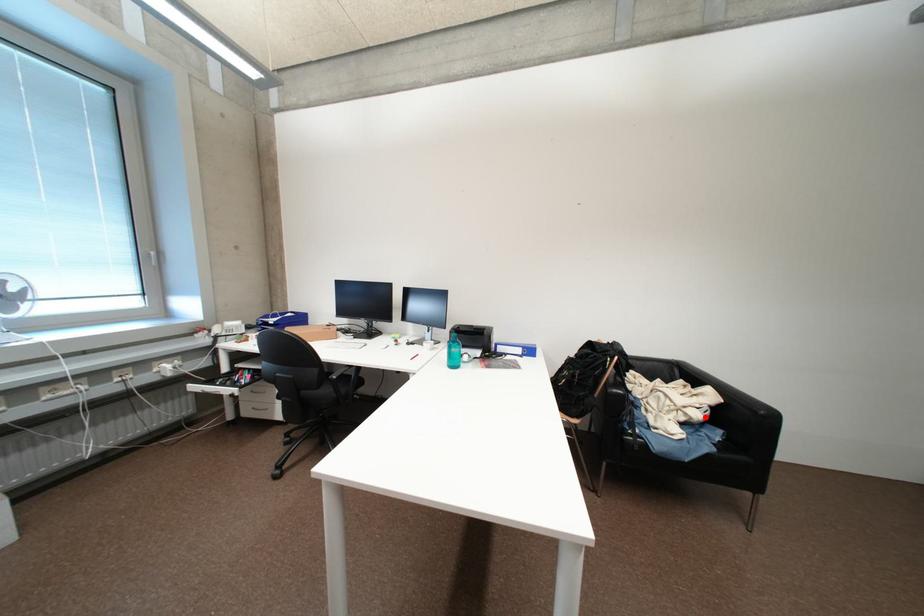
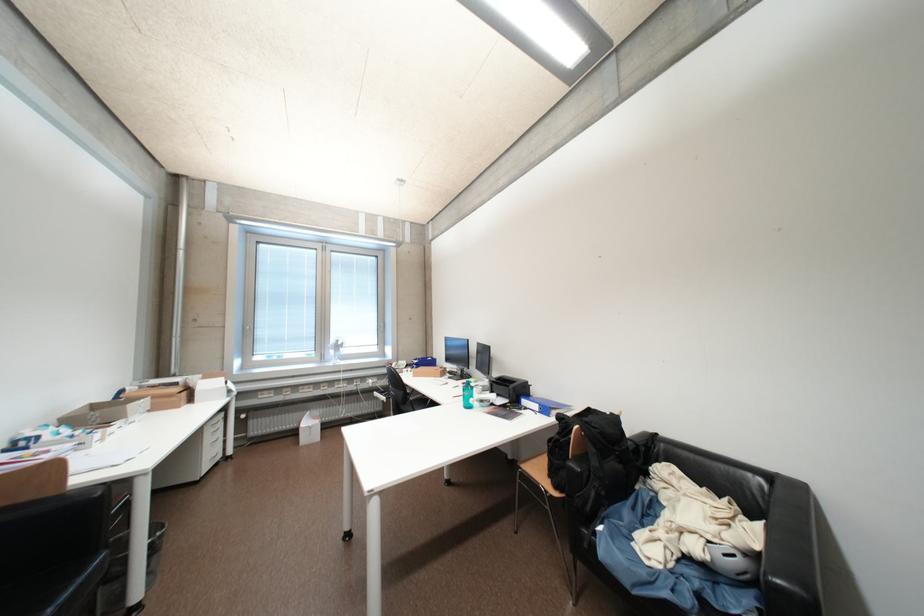
Find the pixel in the second image that matches the highlighted location in the first image.

(704, 551)